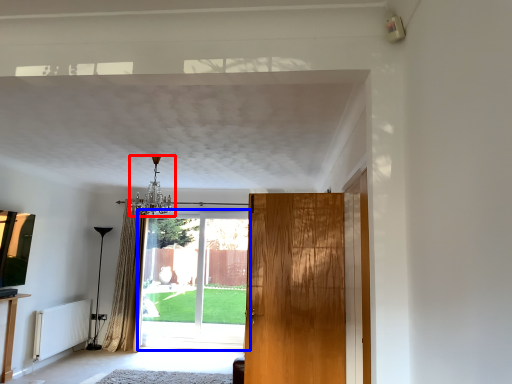
Question: Which point is further to the camera, light fixture (highlighted by a red box) or door (highlighted by a blue box)?

Choices:
 (A) light fixture
 (B) door

Answer: (B)